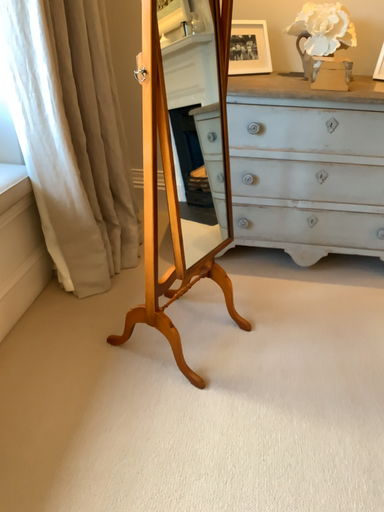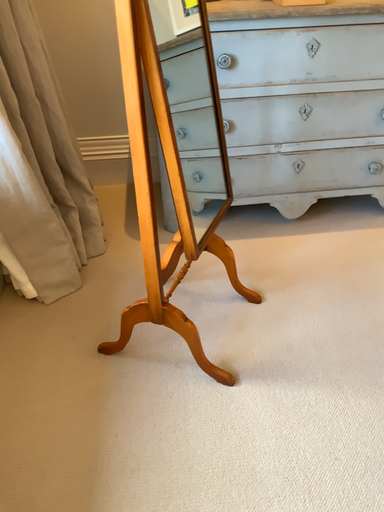
Question: Which way did the camera rotate in the video?

Choices:
 (A) rotated left
 (B) rotated right

Answer: (B)